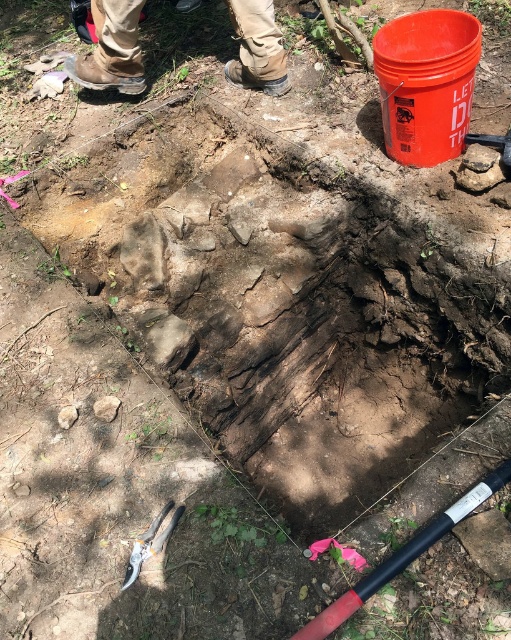
Does brown leather boots at upper left have a larger size compared to black rubber pole at lower center?

Correct, brown leather boots at upper left is larger in size than black rubber pole at lower center.

From the picture: Does brown leather boots at upper left appear on the left side of black rubber pole at lower center?

Correct, you'll find brown leather boots at upper left to the left of black rubber pole at lower center.

The image size is (511, 640). I want to click on brown leather boots at upper left, so click(x=111, y=49).

In order to click on brown leather boots at upper left in this screenshot , I will do tap(111, 49).

Is black rubber pole at lower center closer to camera compared to metallic silver pliers at lower left?

Yes, it is.

Locate an element on the screen. This screenshot has height=640, width=511. black rubber pole at lower center is located at coordinates (403, 556).

At what (x,y) coordinates should I click in order to perform the action: click on black rubber pole at lower center. Please return your answer as a coordinate pair (x, y). Looking at the image, I should click on (403, 556).

Does brown leather boots at upper left have a larger size compared to metallic silver pliers at lower left?

Yes, brown leather boots at upper left is bigger than metallic silver pliers at lower left.

Who is more forward, (128,49) or (151,525)?

Point (151,525) is more forward.

At what (x,y) coordinates should I click in order to perform the action: click on brown leather boots at upper left. Please return your answer as a coordinate pair (x, y). The image size is (511, 640). Looking at the image, I should click on (111, 49).